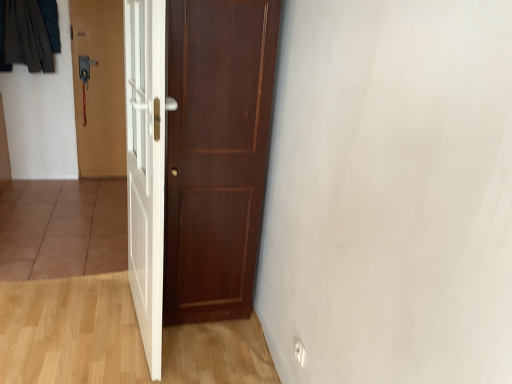
Question: Which direction should I rotate to face white glossy door at center, the third door when ordered from back to front, — up or down?

Choices:
 (A) down
 (B) up

Answer: (B)

Question: Is dark gray fabric at upper left shorter than white glossy door at center, which is the first door from front to back?

Choices:
 (A) yes
 (B) no

Answer: (A)

Question: Is dark gray fabric at upper left not inside white glossy door at center, the third door when ordered from back to front?

Choices:
 (A) yes
 (B) no

Answer: (A)

Question: Is the position of dark gray fabric at upper left more distant than that of white glossy door at center, the third door when ordered from back to front?

Choices:
 (A) yes
 (B) no

Answer: (A)

Question: Does dark gray fabric at upper left appear on the right side of white glossy door at center, which is the first door from front to back?

Choices:
 (A) no
 (B) yes

Answer: (A)

Question: Is dark gray fabric at upper left facing away from white glossy door at center, which is counted as the 2th door, starting from the left?

Choices:
 (A) yes
 (B) no

Answer: (B)

Question: Is dark gray fabric at upper left taller than white glossy door at center, which is the first door from front to back?

Choices:
 (A) no
 (B) yes

Answer: (A)

Question: Considering the relative sizes of wooden door at left, the first door viewed from the left, and white glossy door at center, which is counted as the 2th door, starting from the left, in the image provided, is wooden door at left, the first door viewed from the left, bigger than white glossy door at center, which is counted as the 2th door, starting from the left,?

Choices:
 (A) yes
 (B) no

Answer: (B)

Question: Is wooden door at left, positioned as the 3th door in front-to-back order, outside of white glossy door at center, the third door when ordered from back to front?

Choices:
 (A) yes
 (B) no

Answer: (A)

Question: Is wooden door at left, the first door viewed from the left, looking in the opposite direction of white glossy door at center, which is counted as the 2th door, starting from the left?

Choices:
 (A) yes
 (B) no

Answer: (B)

Question: Is the depth of wooden door at left, arranged as the first door when viewed from the back, less than that of white glossy door at center, which is counted as the 2th door, starting from the left?

Choices:
 (A) yes
 (B) no

Answer: (B)

Question: Is wooden door at left, the third door positioned from the right, oriented towards white glossy door at center, which is the first door from front to back?

Choices:
 (A) no
 (B) yes

Answer: (B)

Question: Does wooden door at left, arranged as the first door when viewed from the back, have a smaller size compared to white glossy door at center, which is counted as the 2th door, starting from the left?

Choices:
 (A) yes
 (B) no

Answer: (A)

Question: Considering the relative positions of matte wood door at center, marked as the second door in a front-to-back arrangement, and dark gray fabric at upper left in the image provided, is matte wood door at center, marked as the second door in a front-to-back arrangement, to the left of dark gray fabric at upper left from the viewer's perspective?

Choices:
 (A) no
 (B) yes

Answer: (A)